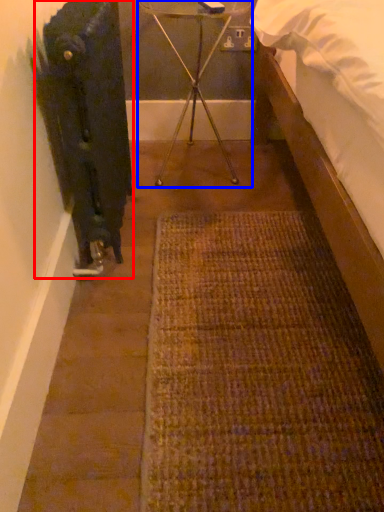
Question: Which of the following is the farthest to the observer, radiator (highlighted by a red box) or tripod (highlighted by a blue box)?

Choices:
 (A) radiator
 (B) tripod

Answer: (B)